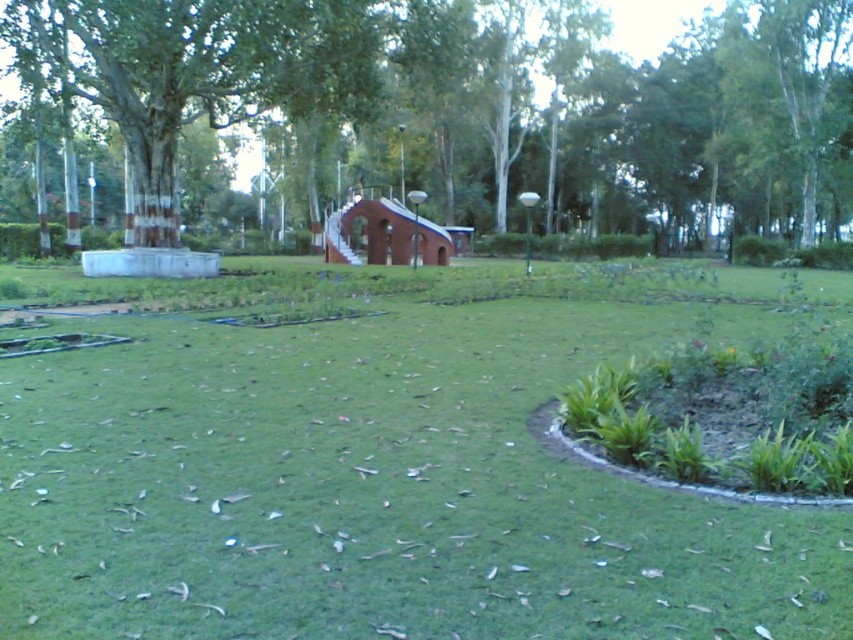
The image size is (853, 640). What are the coordinates of `green leafy tree at upper left` in the screenshot? It's located at (473, 106).

Is the position of green leafy tree at upper left more distant than that of brick/stone hut at center?

No, green leafy tree at upper left is in front of brick/stone hut at center.

Between point (250, 48) and point (366, 256), which one is positioned in front?

Point (250, 48)

What are the coordinates of `green leafy tree at upper left` in the screenshot? It's located at (473, 106).

Based on the photo, how much distance is there between green grass at center and brick/stone hut at center?

The distance of green grass at center from brick/stone hut at center is 17.38 meters.

Does green grass at center appear over brick/stone hut at center?

No, green grass at center is not above brick/stone hut at center.

Which is behind, point (634, 308) or point (335, 259)?

Positioned behind is point (335, 259).

Locate an element on the screen. The width and height of the screenshot is (853, 640). green grass at center is located at coordinates [379, 477].

Can you confirm if green grass at center is bigger than green leafy tree at upper left?

Actually, green grass at center might be smaller than green leafy tree at upper left.

Which is in front, point (476, 356) or point (752, 106)?

Point (476, 356) is more forward.

Is point (241, 301) positioned in front of point (222, 52)?

Yes, point (241, 301) is in front of point (222, 52).

Identify the location of green grass at center. This screenshot has width=853, height=640. (379, 477).